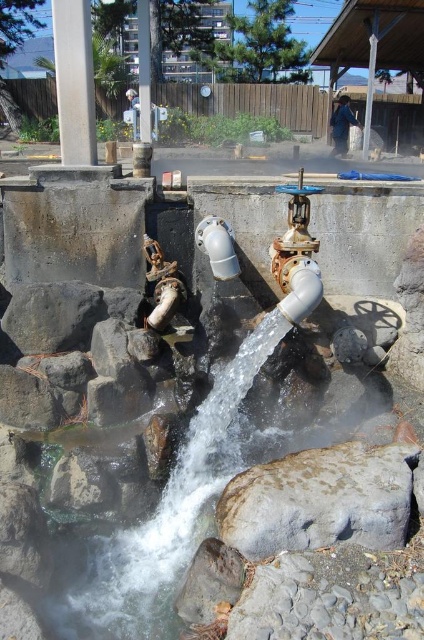
You are a maintenance worker needing to adjust the water flow in the gold metallic valve at center right and the white matte pipe at center. Which object should you handle with both hands due to its size?

The gold metallic valve at center right has a larger size compared to the white matte pipe at center, so you should handle the gold metallic valve at center right with both hands due to its size.

You are standing at the point marked by the coordinates (296, 256) in the image. What object are you directly in front of?

The point marked by the coordinates (296, 256) directly indicates the gold metallic valve at center right.

You are standing at the edge of the water basin and want to locate the point at coordinates point [217,246]. According to the scene description, where exactly would this point be located?

The point [217,246] is on the white matte pipe at center.